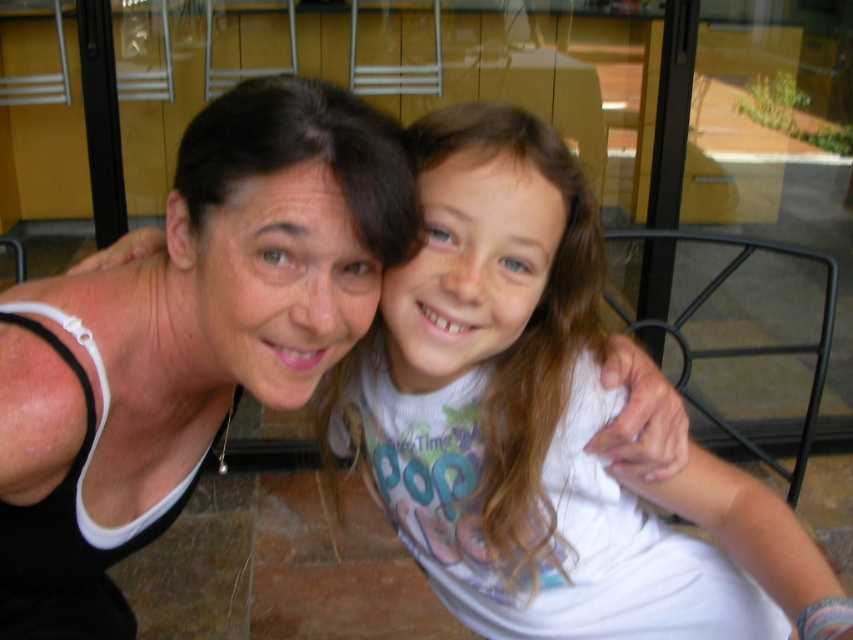
You are a tailor who needs to determine which clothing item requires a larger fabric width for alterations. Based on the scene, which item between the white cotton shirt at center and the matte black tank top at upper left has a greater width?

The white cotton shirt at center has a greater width than the matte black tank top at upper left according to the description.

You are a photographer trying to capture a candid shot of both the white cotton shirt at center and the matte black tank top at upper left. The minimum distance your camera lens can focus on two subjects is 10 inches. Will you be able to capture both in focus?

The white cotton shirt at center and the matte black tank top at upper left are 9.95 inches apart from each other, which is just under the 10 inch minimum focus distance. Therefore, the camera should be able to capture both in focus.

You are a photographer trying to capture the perfect shot of the scene. You need to focus on the white cotton shirt at center. Where exactly should you aim your camera lens to ensure the shirt is in the center of your photo?

To center the white cotton shirt at center in your photo, aim your camera lens precisely at the coordinates point (537,416) where the shirt is located.